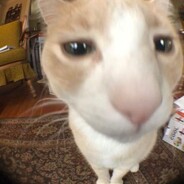
At what (x,y) coordinates should I click in order to perform the action: click on dark yellow soft seat. Please return your answer as a coordinate pair (x, y). Image resolution: width=184 pixels, height=184 pixels. Looking at the image, I should click on (20, 54).